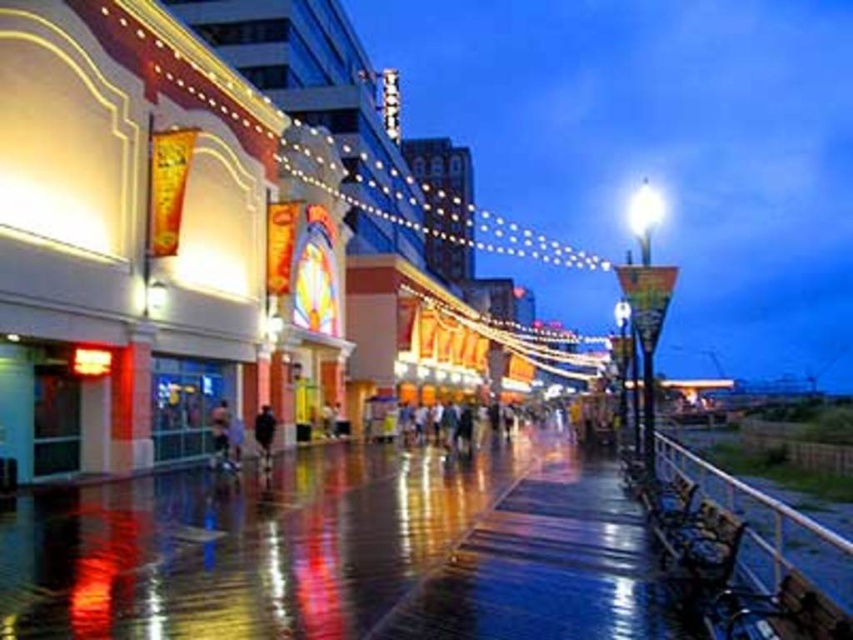
You are standing on the boardwalk and notice the glossy concrete pavement at center and the black matte jacket at center. Which object is positioned lower relative to the other?

The glossy concrete pavement at center is located below the black matte jacket at center, so it is positioned lower.

You are a photographer standing on the boardwalk and want to take a photo of the glossy concrete pavement at center and the black matte jacket at center. Which object should you adjust your camera focus on first if you want to capture the one closer to you?

The black matte jacket at center is closer to you than the glossy concrete pavement at center, so you should focus on the black matte jacket at center first.